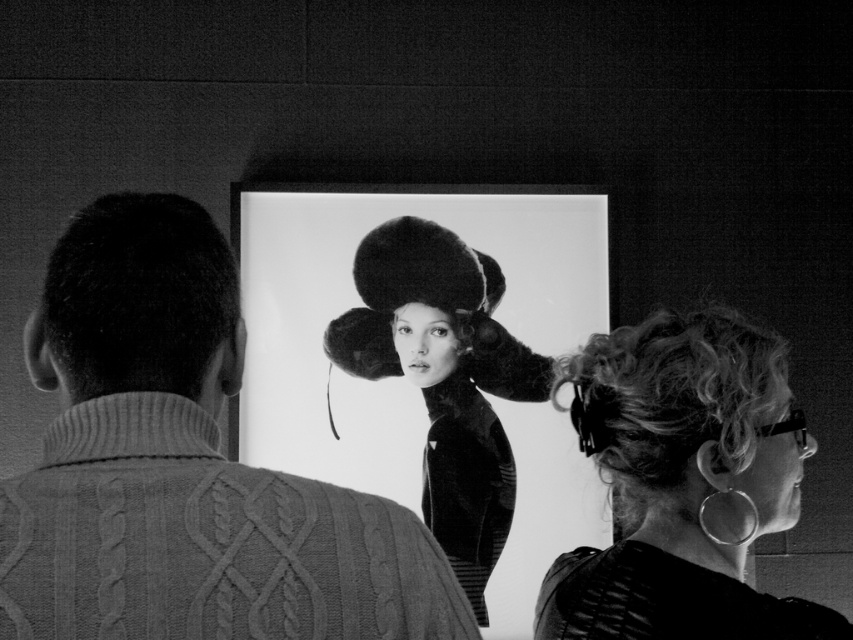
You are a tailor measuring items for alterations. You have a tailor mannequin that can only accommodate items up to 30 cm in width. You need to determine which of the leather jacket at right or the fuzzy fur hat at center can fit on the mannequin. Which item should you choose?

The leather jacket at right has a width less than the fuzzy fur hat at center, so the leather jacket at right can fit on the tailor mannequin since its width is under 30 cm.

You are a tailor who needs to determine which item requires more fabric for alterations. The leather jacket at right and the dark curly hair at left are both in your shop. Which one would need more fabric based on their sizes?

The leather jacket at right has a larger size compared to dark curly hair at left, so it would require more fabric for alterations.